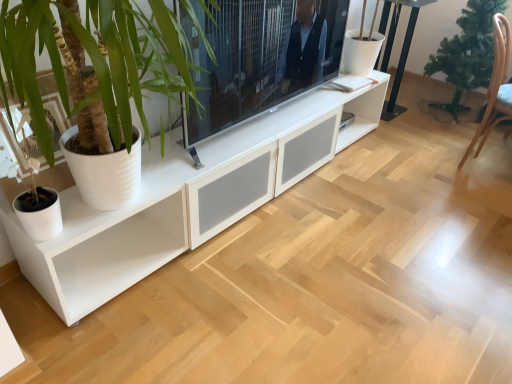
At what (x,y) coordinates should I click in order to perform the action: click on vacant space in green matte christmas tree at right (from a real-world perspective). Please return your answer as a coordinate pair (x, y). Looking at the image, I should click on (449, 117).